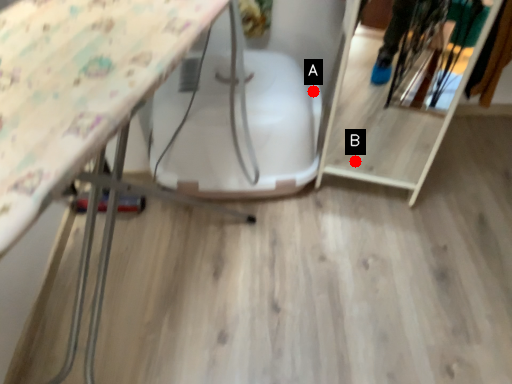
Question: Two points are circled on the image, labeled by A and B beside each circle. Which point is farther to the camera?

Choices:
 (A) A is further
 (B) B is further

Answer: (B)